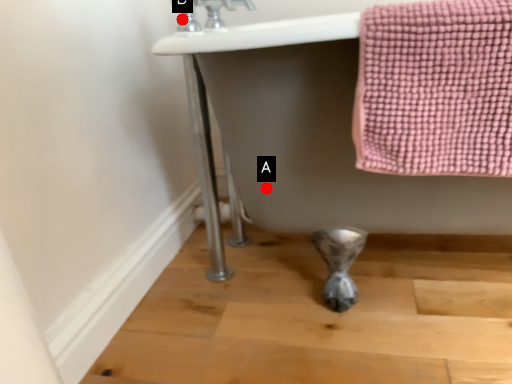
Question: Two points are circled on the image, labeled by A and B beside each circle. Which of the following is the farthest from the observer?

Choices:
 (A) A is further
 (B) B is further

Answer: (B)